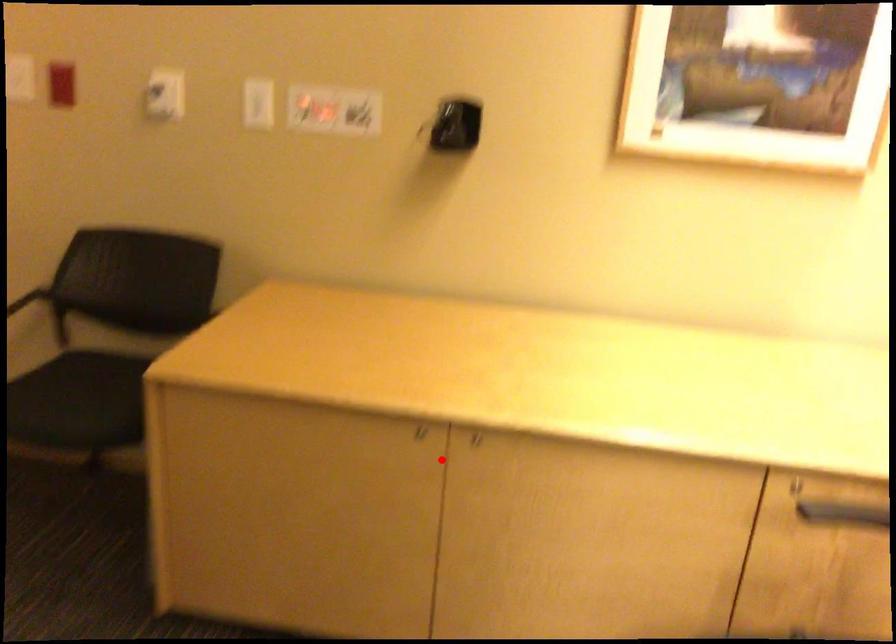
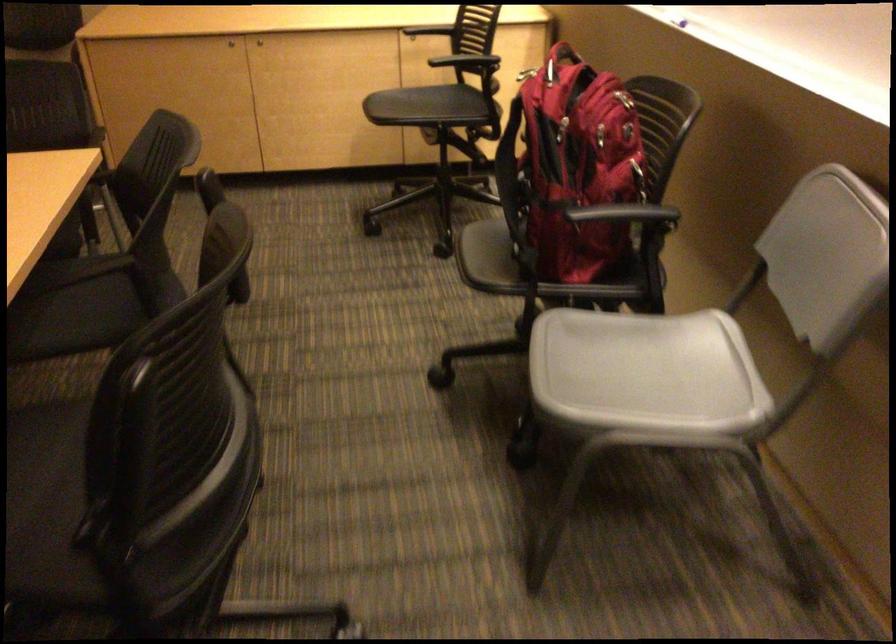
Question: I am providing you with two images of the same scene from different viewpoints. Image1 has a red point marked. In image2, the corresponding 3D location appears at what relative position? Reply with the corresponding letter.

Choices:
 (A) Closer
 (B) Farther

Answer: (B)